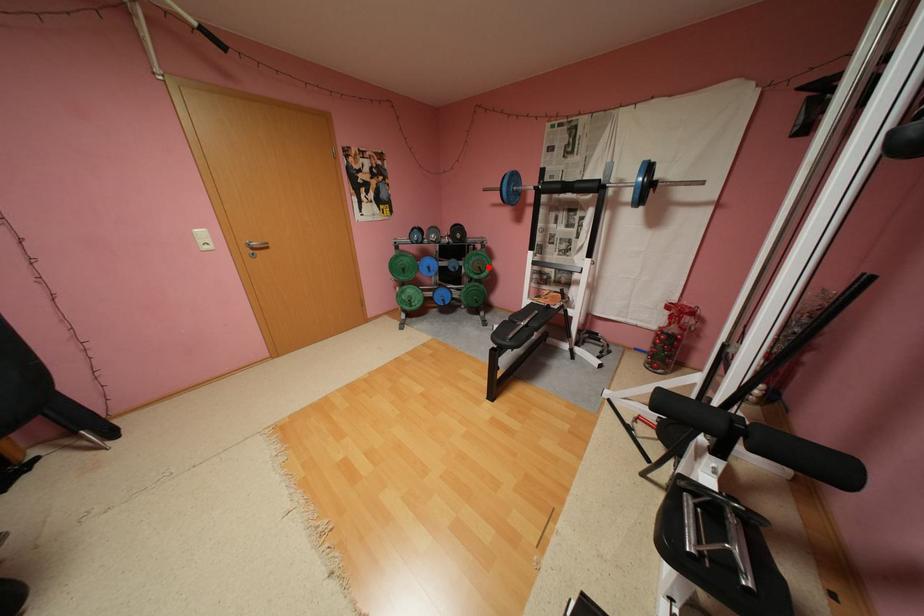
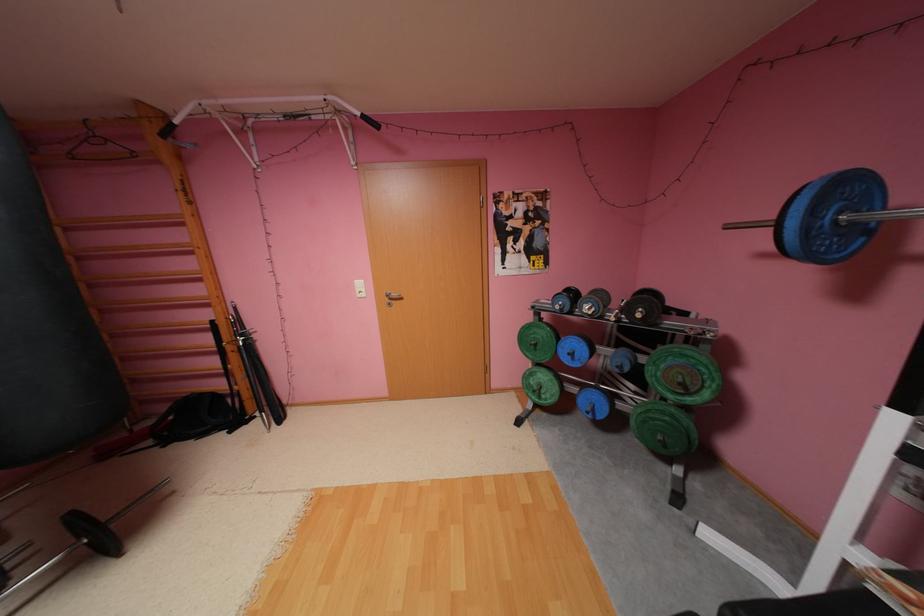
Question: I am providing you with two images of the same scene from different viewpoints. A red point is marked on the first image. Is the red point's position out of view in image 2?

Choices:
 (A) Yes
 (B) No

Answer: (B)